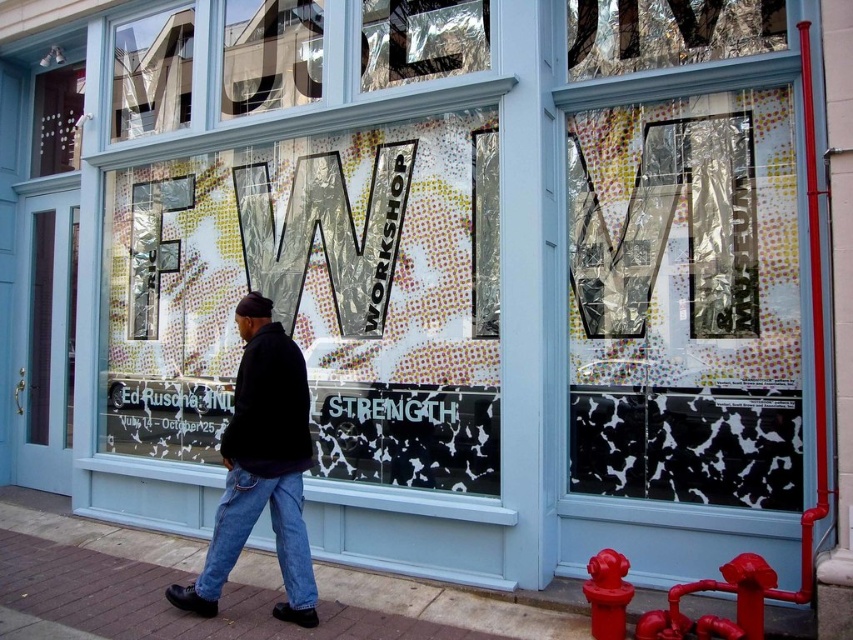
Based on the photo, is brick pavement at lower left positioned at the back of shiny red fire hydrant at lower right?

Yes, brick pavement at lower left is further from the viewer.

Between brick pavement at lower left and shiny red fire hydrant at lower right, which one is positioned higher?

shiny red fire hydrant at lower right is above.

Is point (67, 593) closer to viewer compared to point (585, 564)?

That is False.

The width and height of the screenshot is (853, 640). I want to click on brick pavement at lower left, so click(225, 589).

Which is above, metallic reflective glass at upper left or denim at left?

metallic reflective glass at upper left is higher up.

Does metallic reflective glass at upper left come in front of denim at left?

No, metallic reflective glass at upper left is behind denim at left.

I want to click on metallic reflective glass at upper left, so click(x=270, y=54).

Does metallic reflective foil at upper center have a greater width compared to denim at left?

Yes, metallic reflective foil at upper center is wider than denim at left.

Is metallic reflective foil at upper center to the right of denim at left from the viewer's perspective?

Correct, you'll find metallic reflective foil at upper center to the right of denim at left.

From the picture: Who is more distant from viewer, (471,38) or (297,528)?

Positioned behind is point (471,38).

Where is `metallic reflective foil at upper center`? Image resolution: width=853 pixels, height=640 pixels. metallic reflective foil at upper center is located at coordinates (421, 38).